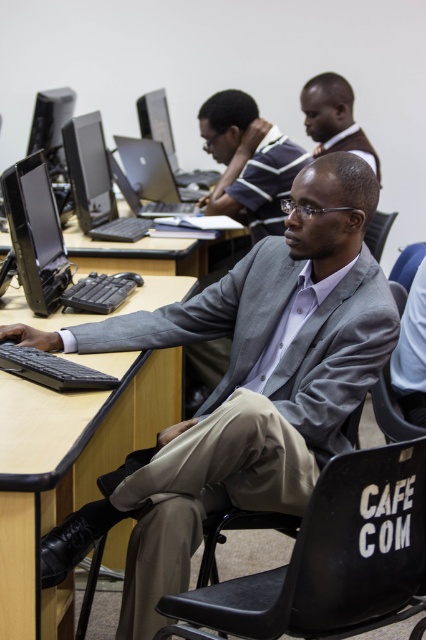
Who is taller, satin black monitor at upper center or black fabric chair at lower right?

satin black monitor at upper center

Is satin black monitor at upper center thinner than black fabric chair at lower right?

No, satin black monitor at upper center is not thinner than black fabric chair at lower right.

Who is more forward, (149,115) or (394,266)?

Point (394,266) is more forward.

The image size is (426, 640). I want to click on satin black monitor at upper center, so click(157, 122).

Looking at this image, is gray suit at center behind black matte monitor at left?

Yes, gray suit at center is behind black matte monitor at left.

The width and height of the screenshot is (426, 640). What do you see at coordinates (247, 163) in the screenshot? I see `gray suit at center` at bounding box center [247, 163].

Between point (236, 112) and point (13, 211), which one is positioned in front?

Point (13, 211) is more forward.

Locate an element on the screen. gray suit at center is located at coordinates (247, 163).

Can you confirm if black leather chair at center is taller than black matte monitor at left?

In fact, black leather chair at center may be shorter than black matte monitor at left.

Who is shorter, black leather chair at center or black matte monitor at left?

With less height is black leather chair at center.

Which is in front, point (215, 598) or point (43, 168)?

Point (215, 598)

You are a GUI agent. You are given a task and a screenshot of the screen. Output one action in this format:
    pyautogui.click(x=<x>, y=<y>)
    Task: Click on the black leather chair at center
    Image resolution: width=426 pixels, height=640 pixels.
    Given the screenshot: What is the action you would take?
    pyautogui.click(x=330, y=560)